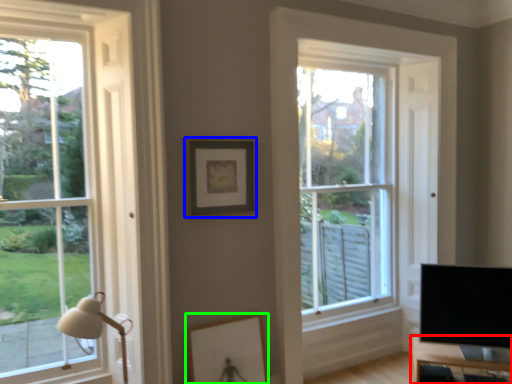
Question: Estimate the real-world distances between objects in this image. Which object is farther from table (highlighted by a red box), picture frame (highlighted by a blue box) or picture frame (highlighted by a green box)?

Choices:
 (A) picture frame
 (B) picture frame

Answer: (A)